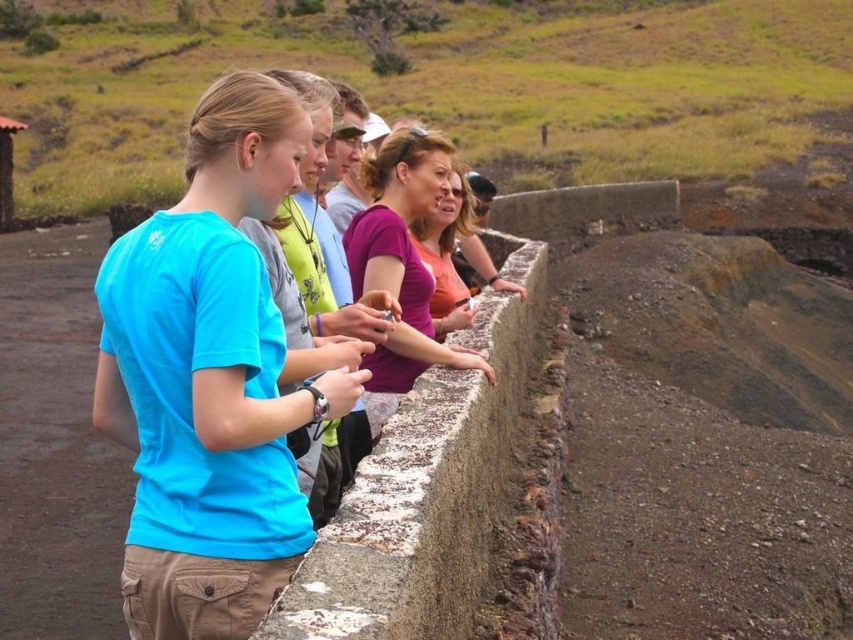
Question: Which is farther from the matte blue t-shirt at center?

Choices:
 (A) purple matte shirt at center
 (B) rusty concrete barrier at center

Answer: (A)

Question: Is rusty concrete barrier at center thinner than matte blue shirt at center?

Choices:
 (A) yes
 (B) no

Answer: (B)

Question: Does rusty concrete barrier at center have a lesser width compared to matte blue shirt at center?

Choices:
 (A) no
 (B) yes

Answer: (A)

Question: Does matte blue t-shirt at center have a lesser width compared to rusty concrete barrier at center?

Choices:
 (A) yes
 (B) no

Answer: (B)

Question: Which object is the closest to the matte blue shirt at center?

Choices:
 (A) purple matte shirt at center
 (B) matte blue t-shirt at center
 (C) rusty concrete barrier at center

Answer: (B)

Question: Based on their relative distances, which object is farther from the matte blue t-shirt at center?

Choices:
 (A) rusty concrete barrier at center
 (B) matte blue shirt at center

Answer: (A)